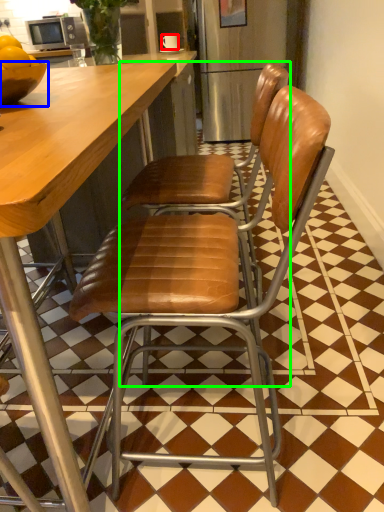
Question: Considering the real-world distances, which object is closest to coffee cup (highlighted by a red box)? bowl (highlighted by a blue box) or chair (highlighted by a green box).

Choices:
 (A) bowl
 (B) chair

Answer: (B)